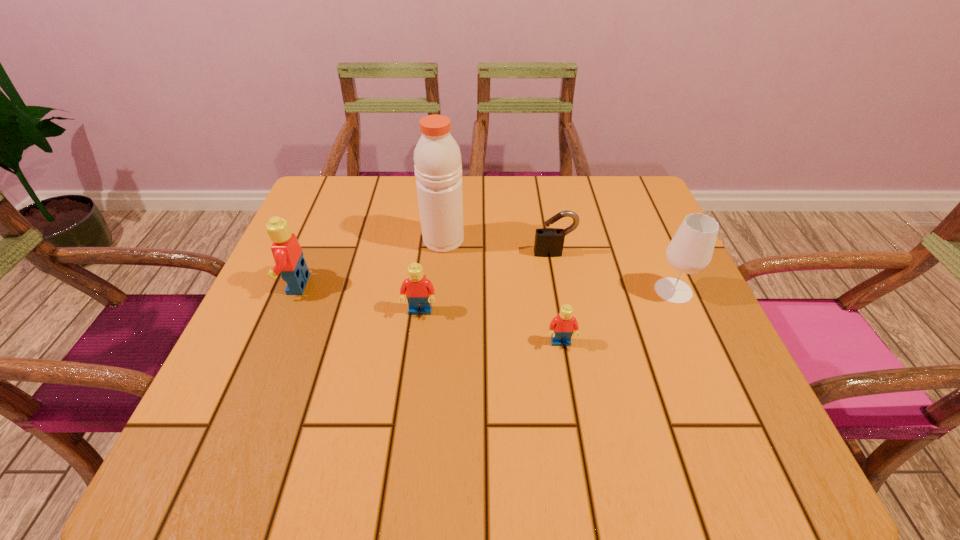
Find the location of a particular element. Image resolution: width=960 pixels, height=540 pixels. vacant region between the tallest object and the second Lego from right to left is located at coordinates 432,276.

Where is `unoccupied area between the second tallest Lego and the leftmost Lego`? The width and height of the screenshot is (960, 540). unoccupied area between the second tallest Lego and the leftmost Lego is located at coordinates (358, 298).

Where is `vacant point located between the shaker and the glass`? vacant point located between the shaker and the glass is located at coordinates (559, 265).

Where is `unoccupied area between the rightmost object and the second tallest Lego`? unoccupied area between the rightmost object and the second tallest Lego is located at coordinates (546, 301).

Identify which object is located as the third nearest to the rightmost object. Please provide its 2D coordinates. Your answer should be formatted as a tuple, i.e. [(x, y)], where the tuple contains the x and y coordinates of a point satisfying the conditions above.

[(438, 168)]

You are a GUI agent. You are given a task and a screenshot of the screen. Output one action in this format:
    pyautogui.click(x=<x>, y=<y>)
    Task: Click on the object that ranks as the closest to the second shortest Lego
    Image resolution: width=960 pixels, height=540 pixels.
    Given the screenshot: What is the action you would take?
    pyautogui.click(x=438, y=168)

Locate an element on the screen. Lego that is the third nearest to the shaker is located at coordinates (562, 326).

Point out which Lego is positioned as the second nearest to the padlock. Please provide its 2D coordinates. Your answer should be formatted as a tuple, i.e. [(x, y)], where the tuple contains the x and y coordinates of a point satisfying the conditions above.

[(419, 290)]

Where is `vacant region that satisfies the following two spatial constraints: 1. with the keyhole on the front of the rightmost object; 2. on the right side of the padlock`? The width and height of the screenshot is (960, 540). vacant region that satisfies the following two spatial constraints: 1. with the keyhole on the front of the rightmost object; 2. on the right side of the padlock is located at coordinates (561, 291).

Find the location of a particular element. vacant area that satisfies the following two spatial constraints: 1. on the front side of the tallest object; 2. on the face of the tallest Lego is located at coordinates (440, 285).